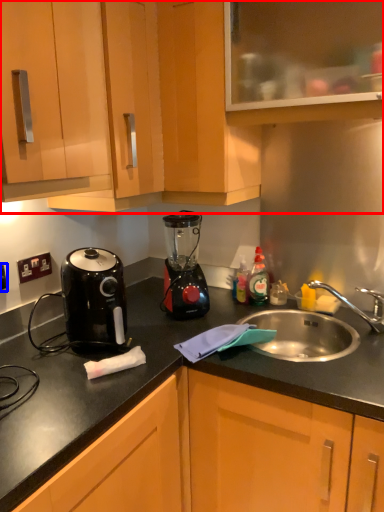
Question: Which object appears closest to the camera in this image, cabinetry (highlighted by a red box) or electric outlet (highlighted by a blue box)?

Choices:
 (A) cabinetry
 (B) electric outlet

Answer: (A)